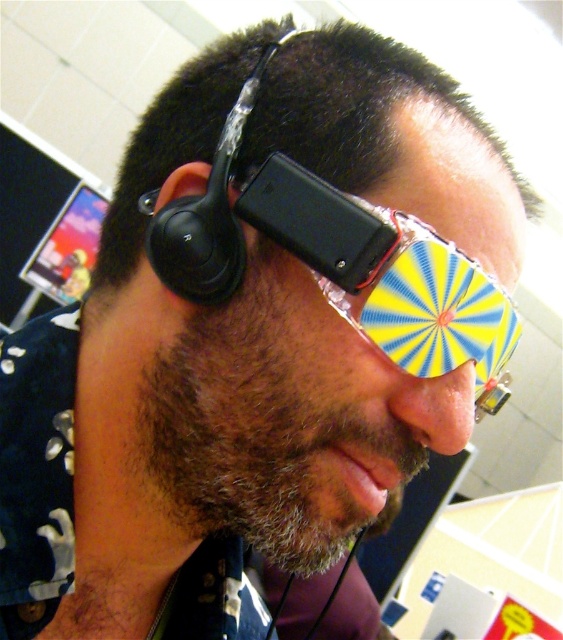
Question: Estimate the real-world distances between objects in this image. Which object is farther from the black matte earbud at upper left?

Choices:
 (A) black matte earphone at left
 (B) translucent plastic goggles at center

Answer: (B)

Question: Can you confirm if black matte earphone at left is positioned above black matte earbud at upper left?

Choices:
 (A) no
 (B) yes

Answer: (A)

Question: Can you confirm if translucent plastic goggles at center is positioned below black matte earphone at left?

Choices:
 (A) yes
 (B) no

Answer: (A)

Question: Which of the following is the closest to the observer?

Choices:
 (A) black matte earphone at left
 (B) black matte earbud at upper left

Answer: (A)

Question: Which object appears closest to the camera in this image?

Choices:
 (A) black matte earphone at left
 (B) black matte earbud at upper left
 (C) translucent plastic goggles at center

Answer: (C)

Question: In this image, where is translucent plastic goggles at center located relative to black matte earbud at upper left?

Choices:
 (A) right
 (B) left

Answer: (A)